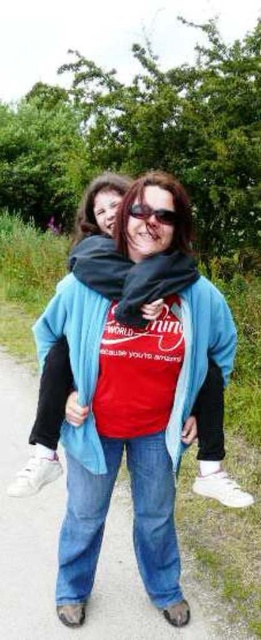
You are trying to determine which object in the scene is larger. You see the denim jeans at lower center and the shiny black sunglasses at center. Which one has a greater size?

The denim jeans at lower center is bigger than the shiny black sunglasses at center, so the denim jeans at lower center is larger.

You are a photographer trying to capture a closeup of the shiny black sunglasses at center while ensuring the denim jeans at lower center are also visible in the frame. Based on their relative sizes, will you need to adjust your camera to a wider angle to include both?

The denim jeans at lower center are wider than the shiny black sunglasses at center. To capture both in the same frame, you would need to adjust your camera to a wider angle since the denim jeans at lower center takes up more horizontal space.

You are a photographer trying to capture a clear photo of the shiny black sunglasses at center. However, the matte blue sweatshirt at center is blocking your view. Can you still take the photo without moving the sweatshirt?

The matte blue sweatshirt at center is in front of the shiny black sunglasses at center, so it is blocking the view. Therefore, you cannot take a clear photo of the shiny black sunglasses at center without moving the sweatshirt.